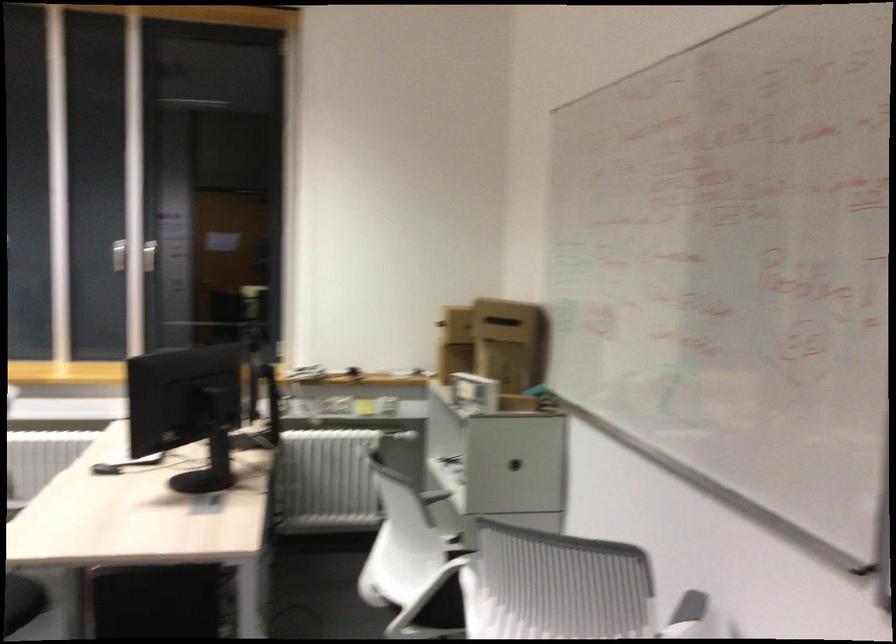
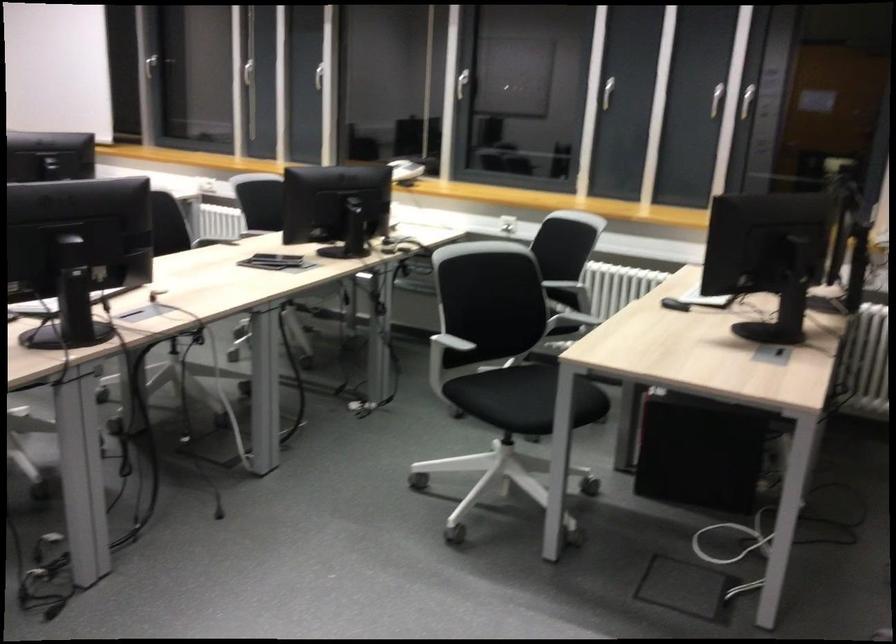
Locate, in the second image, the point that corresponds to pixel 108 473 in the first image.

(675, 304)